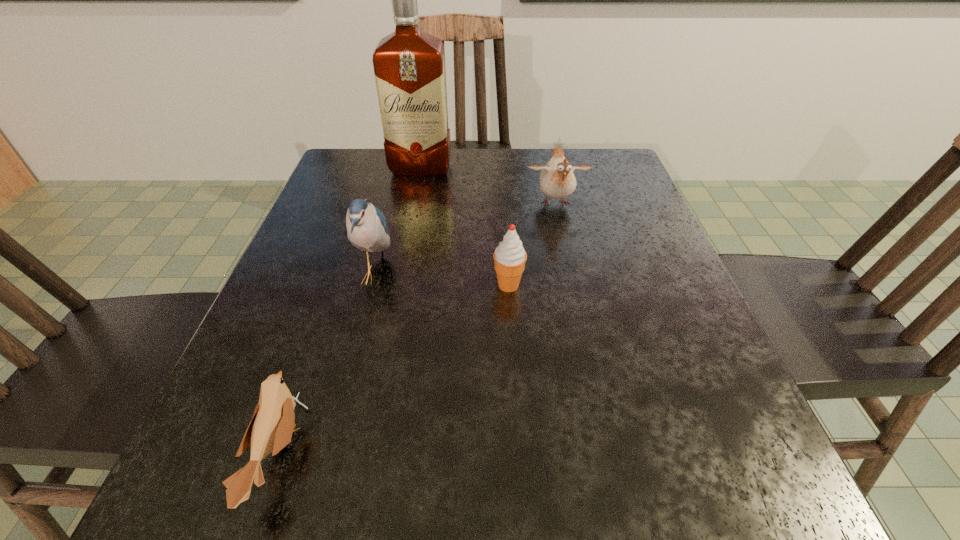
Where is `object situated at the near left corner`? The image size is (960, 540). object situated at the near left corner is located at coordinates (270, 430).

Locate an element on the screen. The width and height of the screenshot is (960, 540). object that is at the far right corner is located at coordinates (557, 180).

At what (x,y) coordinates should I click in order to perform the action: click on vacant point at the far edge. Please return your answer as a coordinate pair (x, y). Image resolution: width=960 pixels, height=540 pixels. Looking at the image, I should click on (478, 150).

Identify the location of free space at the near edge. The image size is (960, 540). (478, 525).

The height and width of the screenshot is (540, 960). Find the location of `vacant region at the left edge of the desktop`. vacant region at the left edge of the desktop is located at coordinates (317, 333).

Locate an element on the screen. free region at the right edge of the desktop is located at coordinates (679, 326).

Image resolution: width=960 pixels, height=540 pixels. I want to click on vacant space at the far left corner of the desktop, so click(359, 159).

Find the location of a particular element. free space at the near left corner of the desktop is located at coordinates (243, 504).

Identify the location of vacant area at the far right corner. (607, 165).

This screenshot has width=960, height=540. I want to click on free location at the near right corner, so click(663, 484).